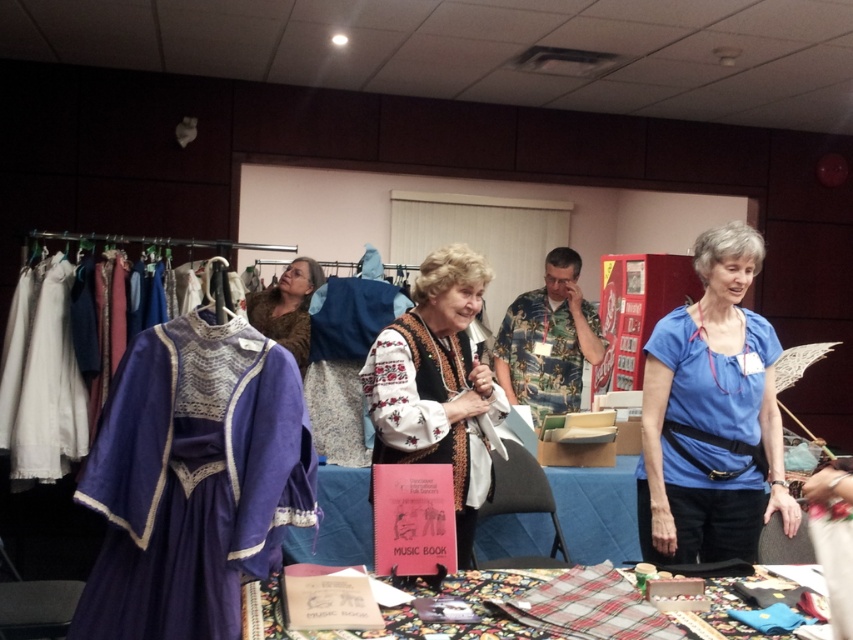
Question: Which point is closer to the camera?

Choices:
 (A) (546, 317)
 (B) (750, 632)
 (C) (132, 620)

Answer: (C)

Question: Can you confirm if embroidered fabric vest at center is positioned below camouflage fabric shirt at center?

Choices:
 (A) no
 (B) yes

Answer: (B)

Question: Which point is farther to the camera?

Choices:
 (A) coord(556,369)
 (B) coord(460,472)
 (C) coord(279,328)
 (D) coord(775,577)

Answer: (A)

Question: In this image, where is purple satin dress at left located relative to blue cotton shirt at right?

Choices:
 (A) above
 (B) below

Answer: (A)

Question: Is blue cotton shirt at right above fuzzy brown scarf at center?

Choices:
 (A) no
 (B) yes

Answer: (A)

Question: Which point is farther to the camera?

Choices:
 (A) flannel fabric at lower center
 (B) blue cotton shirt at right
 (C) purple satin dress at left
 (D) fuzzy brown scarf at center

Answer: (D)